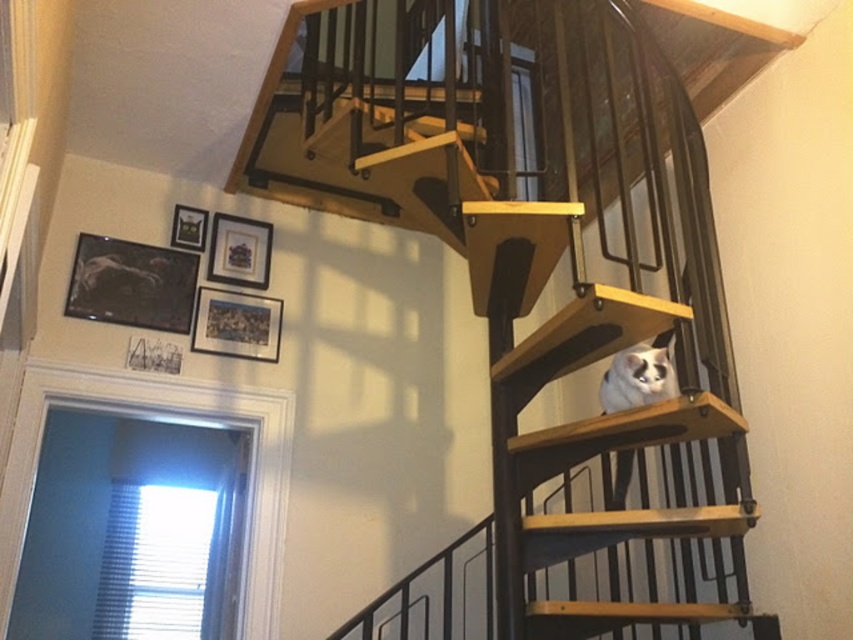
You are standing at point [630,352] and want to move to point [456,48]. Is the point you want to reach in front of or behind you?

The point [456,48] is behind point [630,352], so the destination is behind you.

You are standing at the base of the wooden stairs at center in the image. If you want to take a photo of the stairs from exactly 6 feet away, would you need to move closer or farther away?

The wooden stairs at center are currently 6.16 feet away from the camera. To take a photo from exactly 6 feet away, you would need to move slightly closer to reduce the distance to 6 feet.